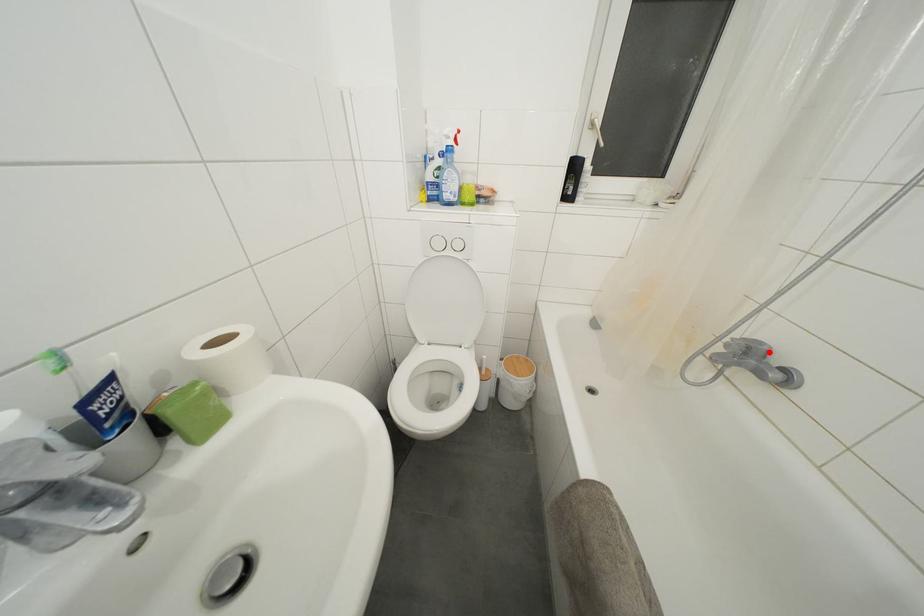
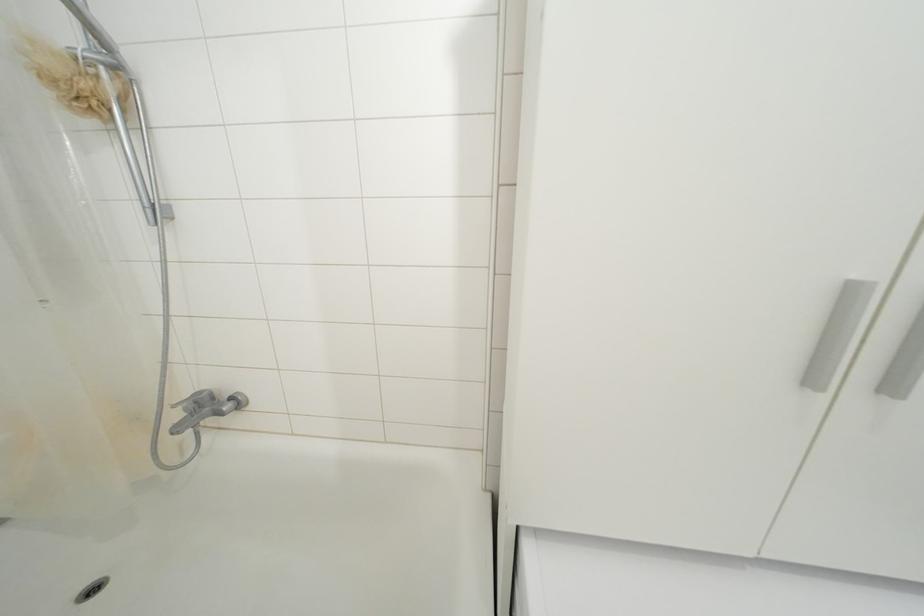
The point at the highlighted location is marked in the first image. Where is the corresponding point in the second image?

(209, 398)